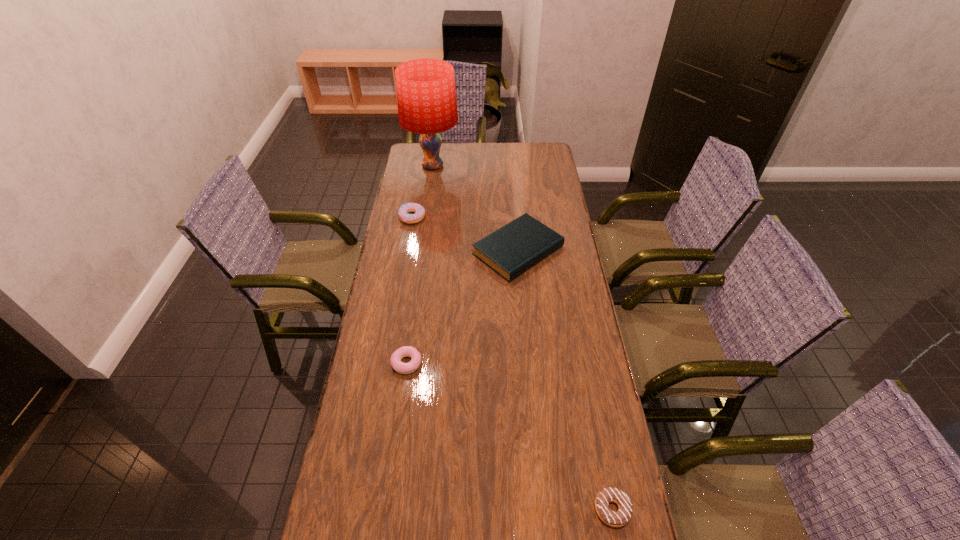
At what (x,y) coordinates should I click in order to perform the action: click on vacant space that satisfies the following two spatial constraints: 1. on the back side of the rightmost doughnut; 2. on the front-facing side of the tallest object. Please return your answer as a coordinate pair (x, y). This screenshot has width=960, height=540. Looking at the image, I should click on (546, 166).

The height and width of the screenshot is (540, 960). What are the coordinates of `vacant space that satisfies the following two spatial constraints: 1. on the front side of the nearest doughnut; 2. on the right side of the fourth farthest object` in the screenshot? It's located at (387, 509).

What are the coordinates of `free space that satisfies the following two spatial constraints: 1. on the back side of the nearest object; 2. on the front-facing side of the tallest object` in the screenshot? It's located at (546, 166).

Identify the location of vacant space that satisfies the following two spatial constraints: 1. on the front-facing side of the lampshade; 2. on the left side of the second nearest doughnut. (405, 363).

At what (x,y) coordinates should I click in order to perform the action: click on free location that satisfies the following two spatial constraints: 1. on the front side of the farthest doughnut; 2. on the left side of the book. Please return your answer as a coordinate pair (x, y). Looking at the image, I should click on (407, 251).

You are a GUI agent. You are given a task and a screenshot of the screen. Output one action in this format:
    pyautogui.click(x=<x>, y=<y>)
    Task: Click on the free space that satisfies the following two spatial constraints: 1. on the front side of the farthest doughnut; 2. on the left side of the fourth farthest object
    This screenshot has width=960, height=540.
    Given the screenshot: What is the action you would take?
    point(387,363)

Identify the location of free spot that satisfies the following two spatial constraints: 1. on the front-facing side of the farthest object; 2. on the back side of the second nearest doughnut. This screenshot has width=960, height=540. (405, 363).